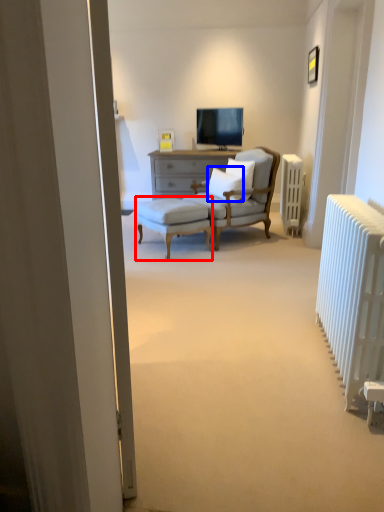
Question: Which object is further to the camera taking this photo, stool (highlighted by a red box) or pillow (highlighted by a blue box)?

Choices:
 (A) stool
 (B) pillow

Answer: (B)